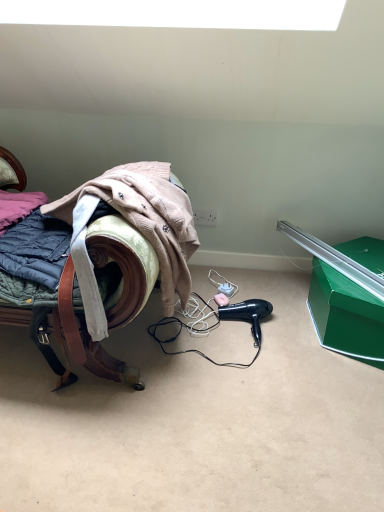
Identify the location of empty space that is to the right of velvet green suitcase at left. This screenshot has width=384, height=512. click(263, 359).